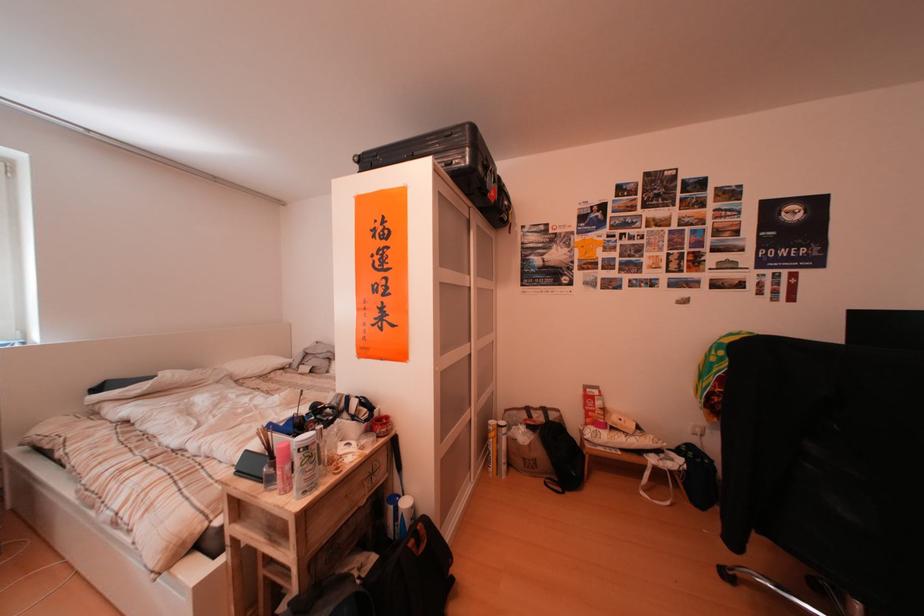
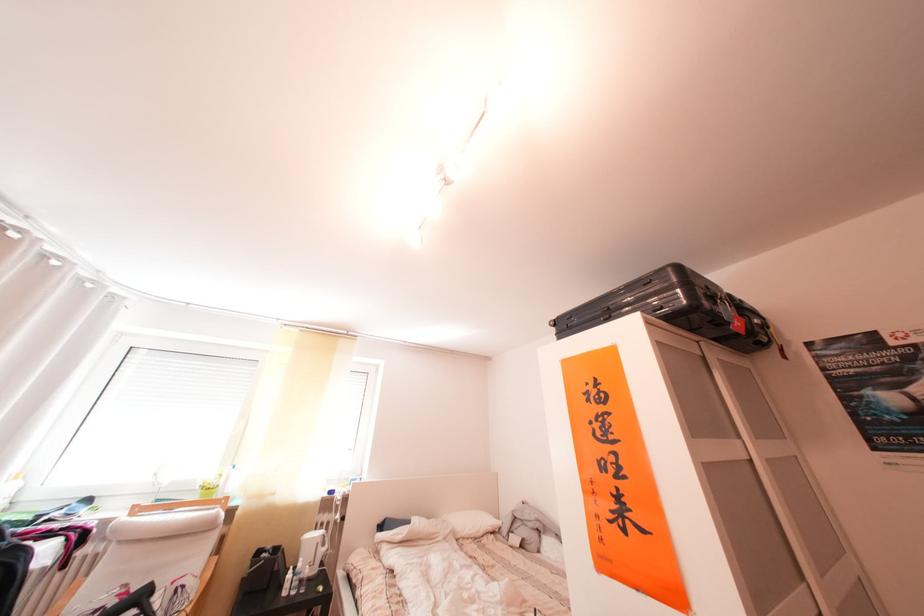
Where in the second image is the point corresponding to (481,280) from the first image?

(751, 442)